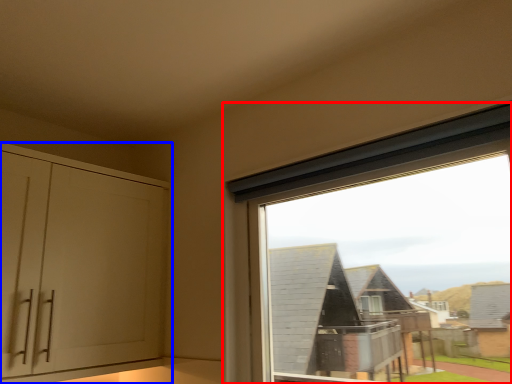
Question: Among these objects, which one is nearest to the camera, window (highlighted by a red box) or cabinetry (highlighted by a blue box)?

Choices:
 (A) window
 (B) cabinetry

Answer: (A)